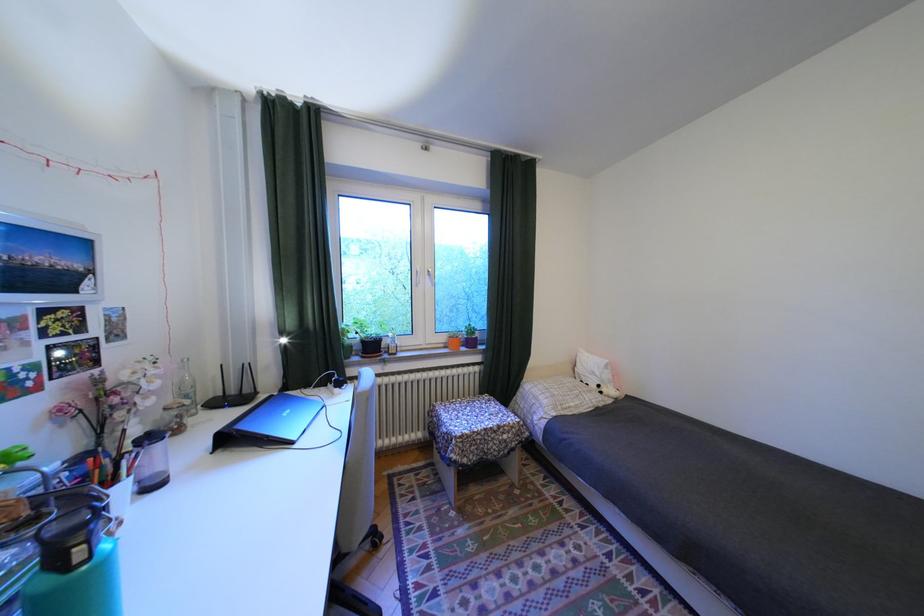
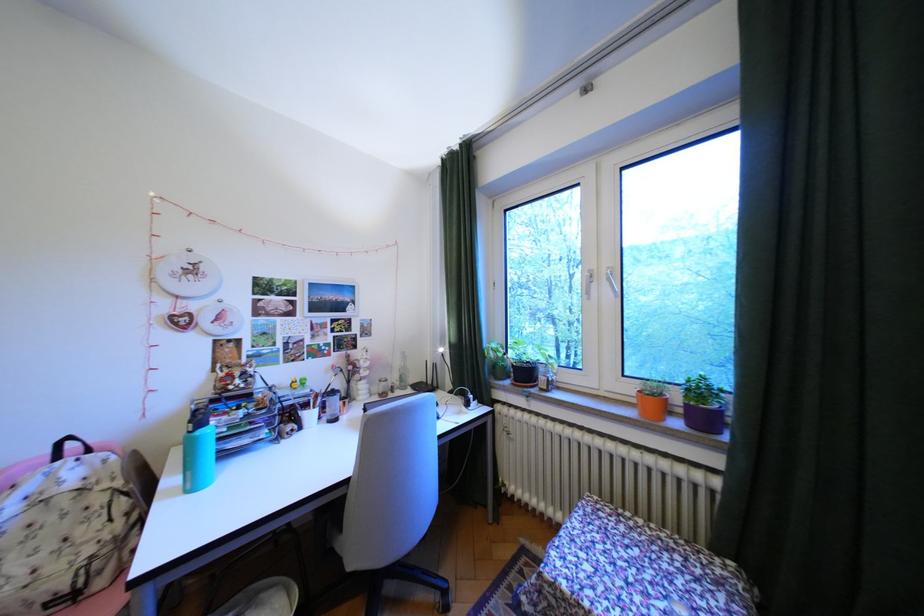
Locate, in the second image, the point that corresponds to the point at 455,339 in the first image.

(641, 390)